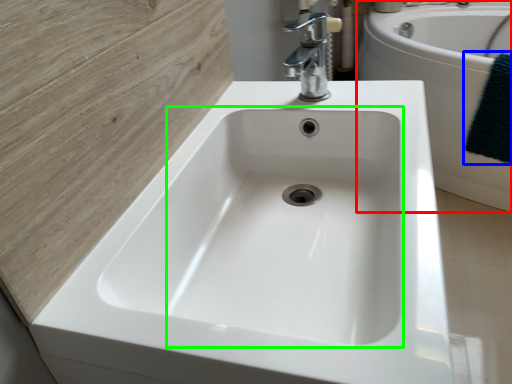
Question: Which object is the closest to the bath (highlighted by a red box)? Choose among these: bath towel (highlighted by a blue box) or sink (highlighted by a green box).

Choices:
 (A) bath towel
 (B) sink

Answer: (A)